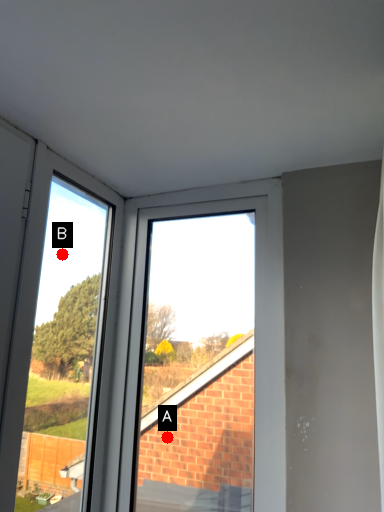
Question: Two points are circled on the image, labeled by A and B beside each circle. Among these points, which one is farthest from the camera?

Choices:
 (A) A is further
 (B) B is further

Answer: (B)